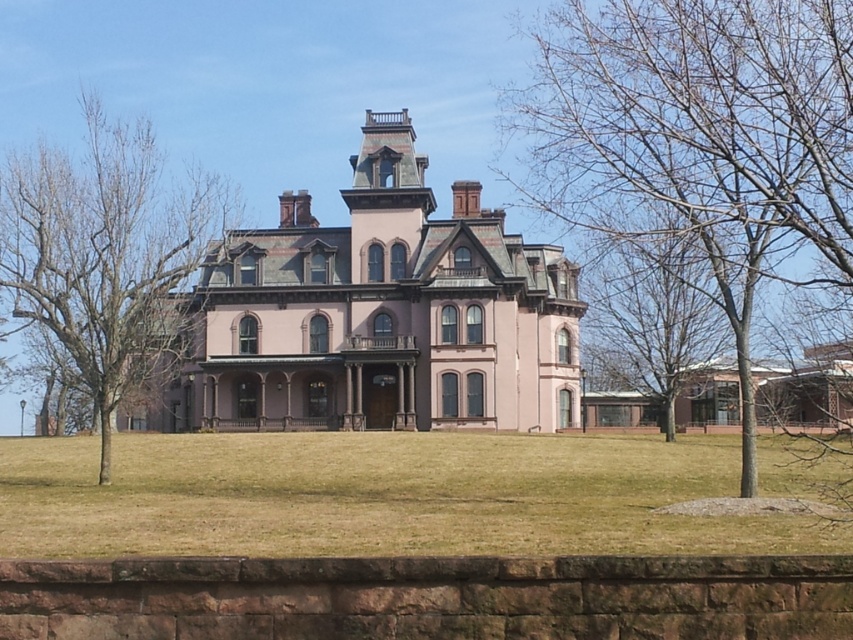
You are standing in front of the pink matte mansion at center and want to take a photo of the bare wood tree at left. Since the mansion is closer to you, will it block your view of the tree?

The pink matte mansion at center is further to the viewer than bare wood tree at left, so the mansion is closer to you. This means the mansion will block your view of the bare wood tree at left.

You are standing in front of the Victorian mansion and want to place a decorative statue between the two points, point (434, 380) and point (634, 80). Which point should the statue be closer to in order to be closer to the mansion?

The statue should be closer to point (634, 80) because it is farther from the viewer than point (434, 380), meaning it is nearer to the mansion.